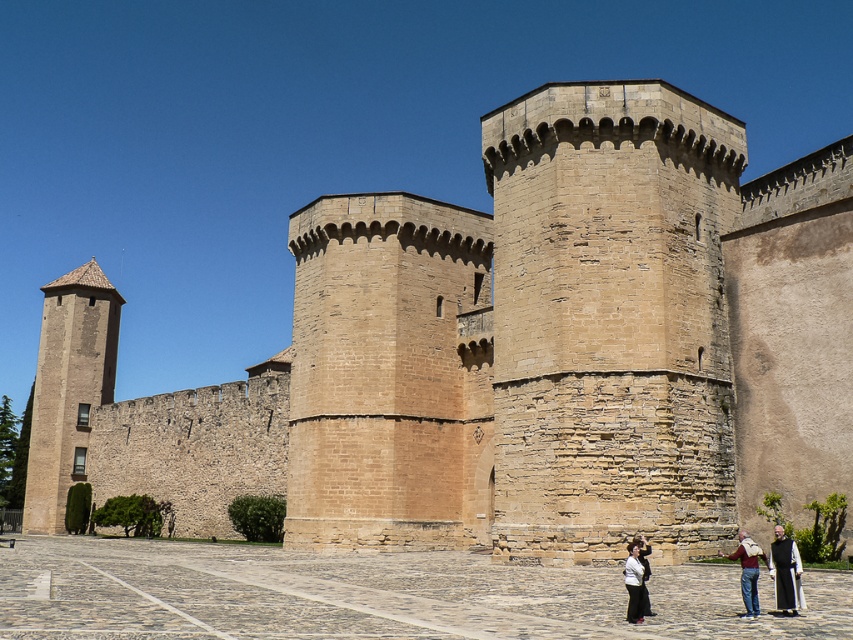
Question: Is dark brown robe at lower right to the right of white cotton shirt at lower center from the viewer's perspective?

Choices:
 (A) yes
 (B) no

Answer: (A)

Question: Which point is closer to the camera?

Choices:
 (A) (744, 589)
 (B) (627, 605)
 (C) (51, 480)

Answer: (A)

Question: Is dark brown robe at lower right positioned behind white cotton shirt at lower center?

Choices:
 (A) yes
 (B) no

Answer: (B)

Question: Considering the real-world distances, which object is closest to the denim jeans at lower right?

Choices:
 (A) brown stone tower at left
 (B) dark brown robe at lower right

Answer: (B)

Question: Where is dark brown robe at lower right located in relation to denim jeans at lower right in the image?

Choices:
 (A) right
 (B) left

Answer: (B)

Question: Which of the following is the farthest from the observer?

Choices:
 (A) (55, 289)
 (B) (763, 556)

Answer: (A)